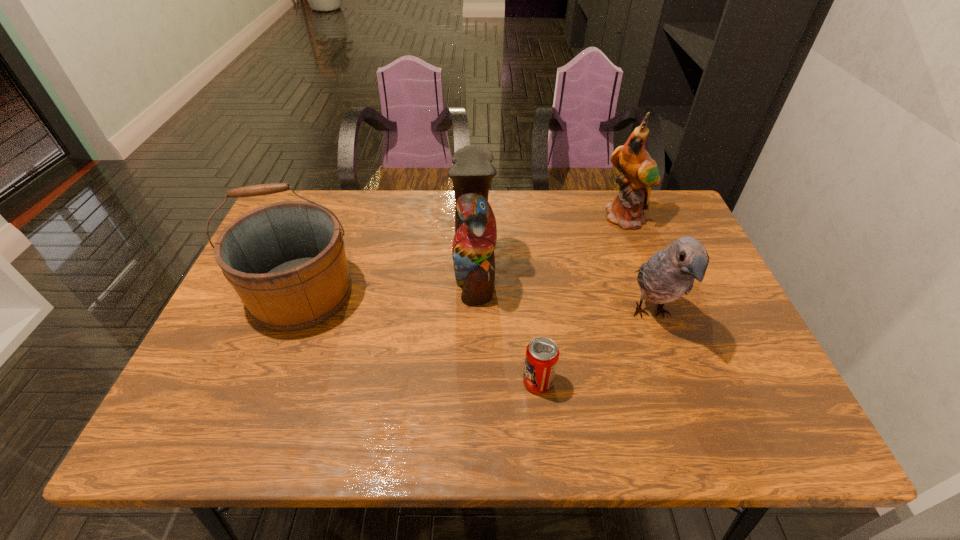
I want to click on vacant point located between the shortest parrot and the third object from left to right, so click(x=594, y=348).

The image size is (960, 540). In order to click on free spot between the soda can and the second shortest object in this screenshot , I will do `click(594, 348)`.

Image resolution: width=960 pixels, height=540 pixels. Find the location of `vacant space that's between the nearest object and the fourth object from right to left`. vacant space that's between the nearest object and the fourth object from right to left is located at coordinates (506, 328).

This screenshot has width=960, height=540. I want to click on unoccupied position between the shortest parrot and the leftmost parrot, so click(563, 294).

Find the location of a particular element. The width and height of the screenshot is (960, 540). free space between the bucket and the nearest object is located at coordinates (420, 338).

I want to click on object that can be found as the closest to the nearest object, so click(475, 237).

This screenshot has width=960, height=540. I want to click on the third closest object relative to the leftmost object, so click(670, 273).

At what (x,y) coordinates should I click in order to perform the action: click on parrot that is the closest to the second shortest object. Please return your answer as a coordinate pair (x, y). This screenshot has height=540, width=960. Looking at the image, I should click on (640, 171).

You are a GUI agent. You are given a task and a screenshot of the screen. Output one action in this format:
    pyautogui.click(x=<x>, y=<y>)
    Task: Click on the closest parrot to the leftmost parrot
    The width and height of the screenshot is (960, 540).
    Given the screenshot: What is the action you would take?
    pyautogui.click(x=670, y=273)

In order to click on vacant space that satisfies the following two spatial constraints: 1. on the front-facing side of the farthest object; 2. at the face of the second object from left to right in this screenshot , I will do `click(648, 275)`.